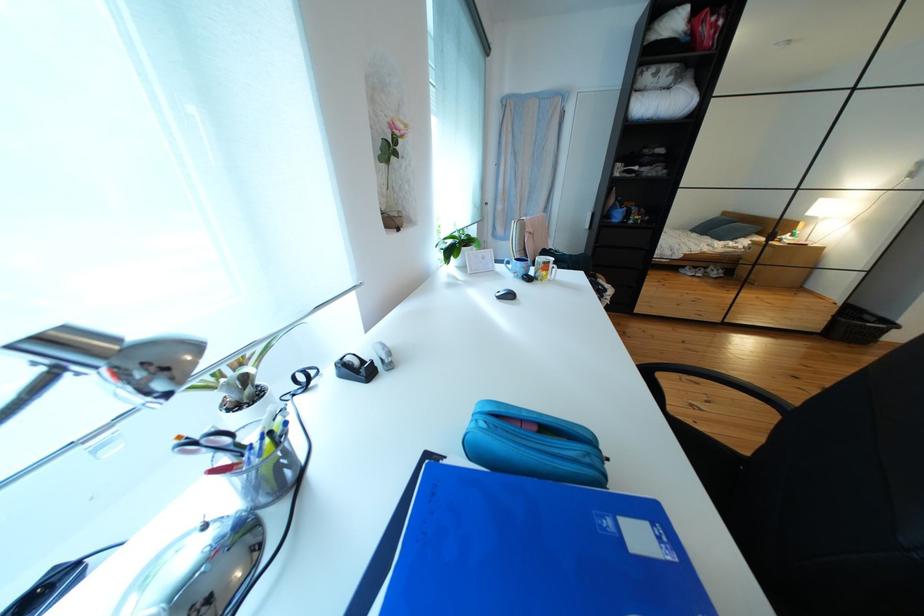
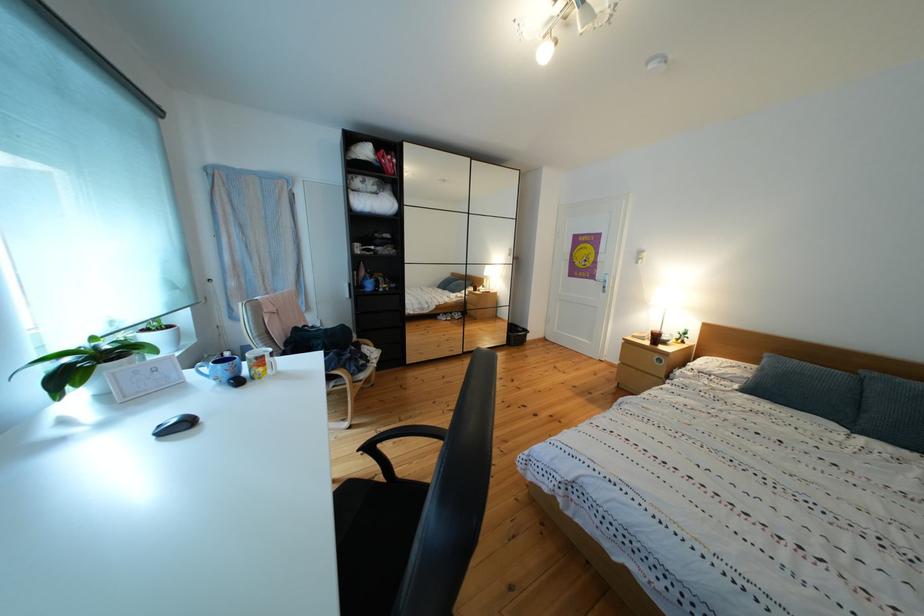
Locate, in the second image, the point that corresponds to (x=561, y=268) in the first image.

(274, 362)